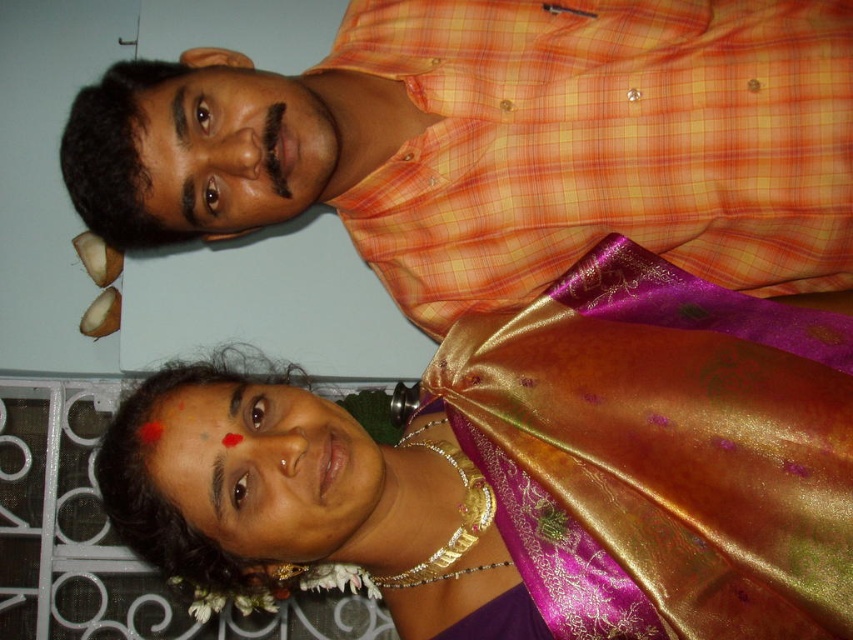
You are planning to take a photo of both the shiny silk saree at center and the orange checkered shirt at upper center. Since you want to capture both items clearly in the frame, which object should you focus on first to ensure proper focus? Please explain your reasoning based on their sizes.

The shiny silk saree at center should be focused on first because its width is larger than the orange checkered shirt at upper center. A larger object requires more focus area to capture all details clearly, so starting with the wider saree ensures both items are in focus when adjusting the camera settings.

You are a photographer who wants to capture a closeup shot of the shiny silk saree at center. The camera you are using has a minimum focusing distance of 25 inches. Can you take the photo without moving closer than 25 inches?

The shiny silk saree at center is 30.04 inches from the camera, which is beyond the minimum focusing distance of 25 inches. Therefore, you can take the photo without moving closer than 25 inches.

Consider the image. Based on the scene description, where is the shiny silk saree at center located in terms of coordinates?

The shiny silk saree at center is located at point [531,468].